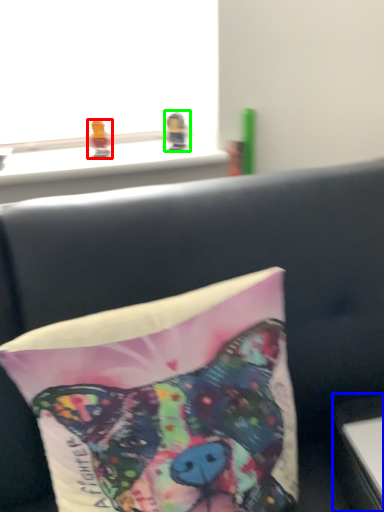
Question: Based on their relative distances, which object is nearer to toy (highlighted by a red box)? Choose from table (highlighted by a blue box) and toy (highlighted by a green box).

Choices:
 (A) table
 (B) toy

Answer: (B)